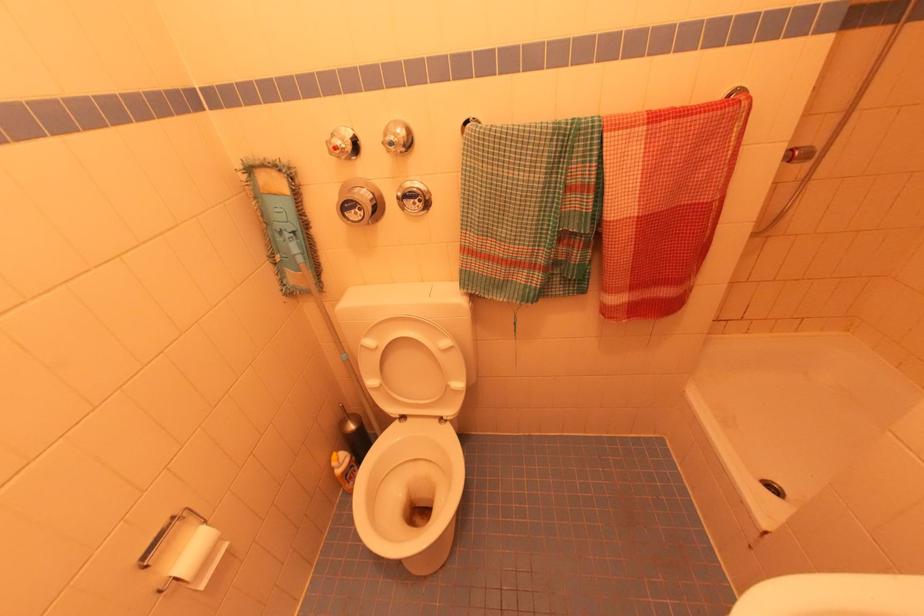
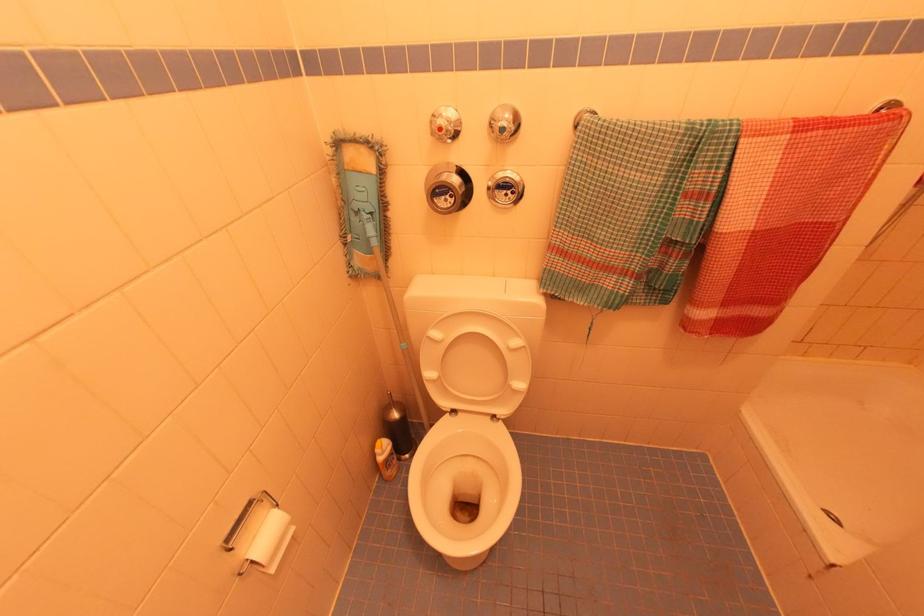
Where in the second image is the point corresponding to (x=204, y=586) from the first image?

(274, 570)